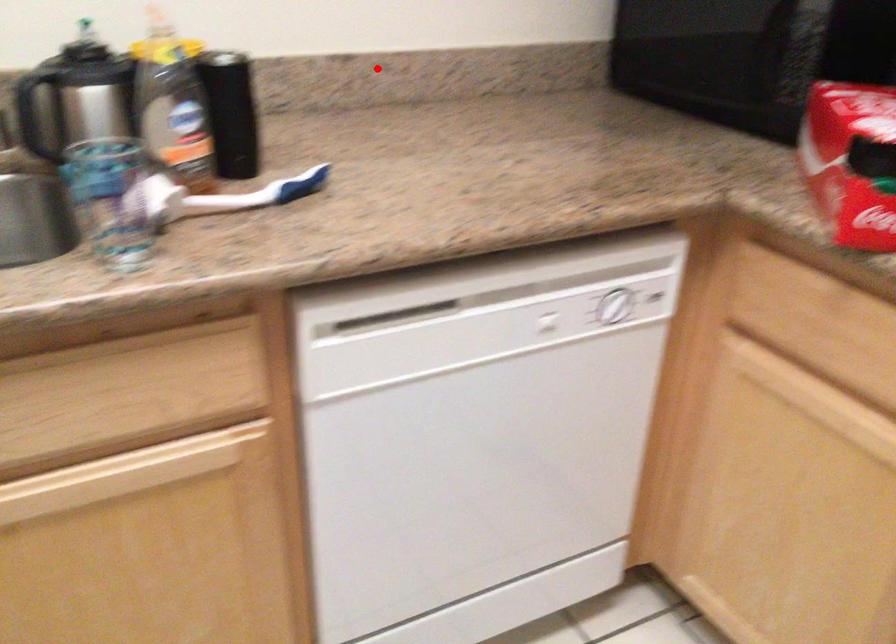
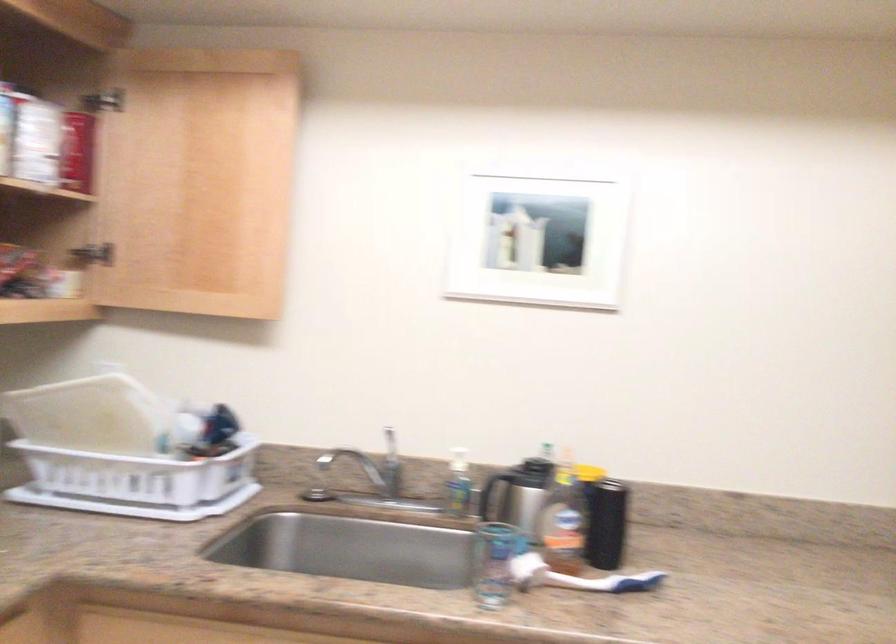
Question: I am providing you with two images of the same scene from different viewpoints. A red point is shown in image1. For the corresponding object point in image2, is it positioned nearer or farther from the camera?

Choices:
 (A) Nearer
 (B) Farther

Answer: (B)